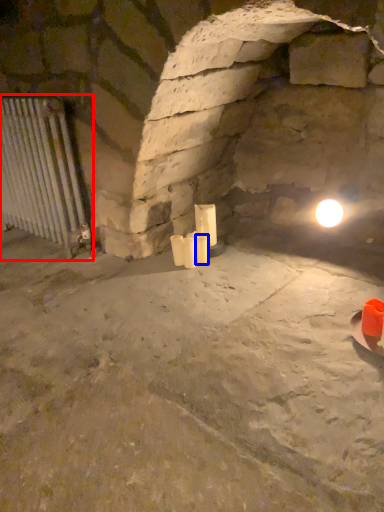
Question: Which object is further to the camera taking this photo, cage (highlighted by a red box) or candle (highlighted by a blue box)?

Choices:
 (A) cage
 (B) candle

Answer: (B)